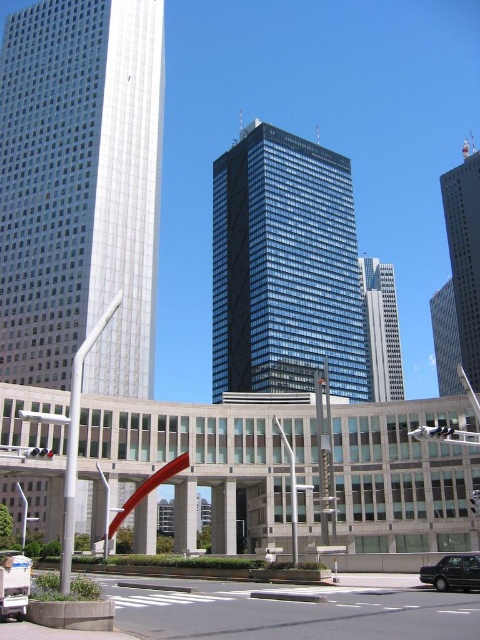
You are standing at the pedestrian crossing marked by white lines on the asphalt and want to take a photo of the silver glass skyscraper at left. Based on your position, will the skyscraper appear on the left or right side of your photo?

The silver glass skyscraper at left is located at point (80, 189) in 2D coordinates, which places it on the left side of the frame from your perspective at the pedestrian crossing. Therefore, it will appear on the left side of your photo.

You are a city planner who needs to install a new streetlight between the glassy blue skyscraper at center and the glassy steel skyscraper at center. The streetlight requires a minimum of 100 feet of space between the two buildings to be safely installed. Based on the provided information, can the streetlight be placed between them?

The glassy blue skyscraper at center is 105.24 feet away from glassy steel skyscraper at center, which exceeds the required 100 feet of space. Therefore, the streetlight can be safely installed between them.

You are a delivery person trying to navigate through the street. You see the silver glass skyscraper at left and the black glossy sedan at lower right. Which object is closer to you from your current viewpoint?

The silver glass skyscraper at left is positioned over the black glossy sedan at lower right, indicating that the black glossy sedan at lower right is closer to you.